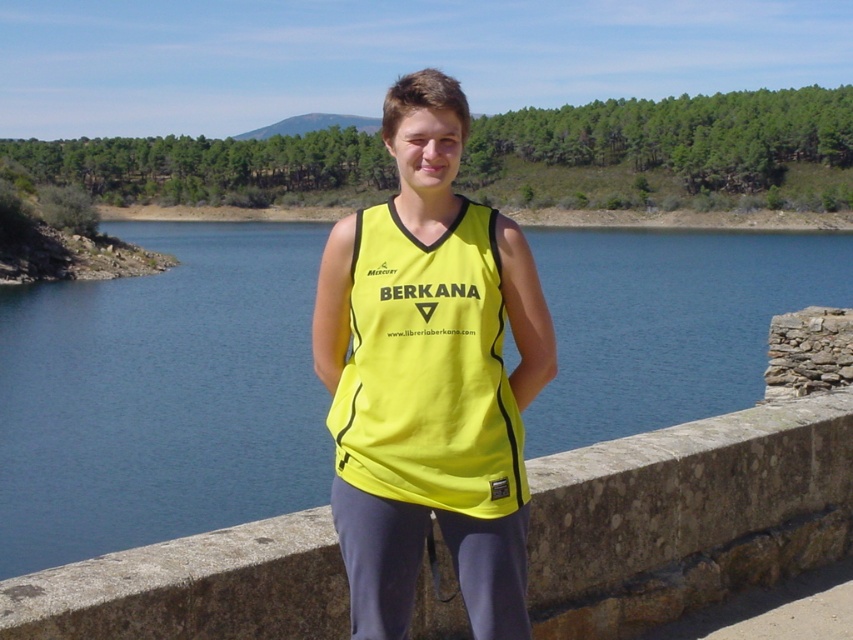
Describe the element at coordinates (428, 369) in the screenshot. The height and width of the screenshot is (640, 853). I see `yellow fabric safety vest at center` at that location.

The height and width of the screenshot is (640, 853). In order to click on yellow fabric safety vest at center in this screenshot , I will do `click(428, 369)`.

Measure the distance between point (482,384) and camera.

Point (482,384) and camera are 15.58 feet apart.

Which is in front, point (404, 289) or point (357, 445)?

Point (357, 445) is in front.

I want to click on yellow fabric tank top at center, so click(x=428, y=376).

Consider the image. Can you confirm if smooth stone ledge at center is shorter than yellow fabric safety vest at center?

Indeed, smooth stone ledge at center has a lesser height compared to yellow fabric safety vest at center.

Does point (836, 531) lie behind point (506, 468)?

Yes.

You are a GUI agent. You are given a task and a screenshot of the screen. Output one action in this format:
    pyautogui.click(x=<x>, y=<y>)
    Task: Click on the smooth stone ledge at center
    
    Given the screenshot: What is the action you would take?
    pyautogui.click(x=688, y=515)